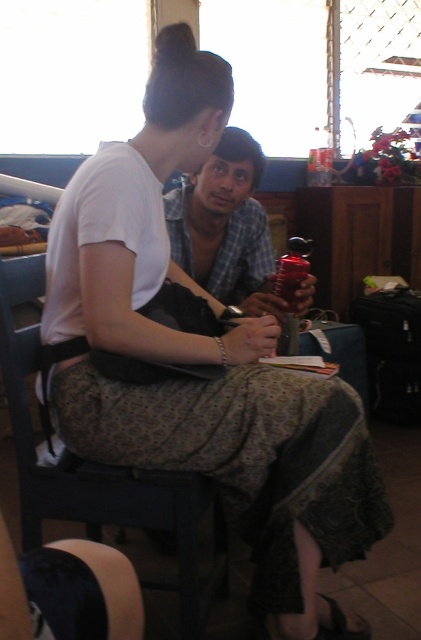
Can you confirm if dark wood chair at center is shorter than matte plastic water bottle at center?

No, dark wood chair at center is not shorter than matte plastic water bottle at center.

This screenshot has width=421, height=640. In order to click on dark wood chair at center in this screenshot , I will do `click(103, 474)`.

Does point (114, 474) come in front of point (234, 296)?

Yes, it is in front of point (234, 296).

Where is `dark wood chair at center`? dark wood chair at center is located at coordinates (103, 474).